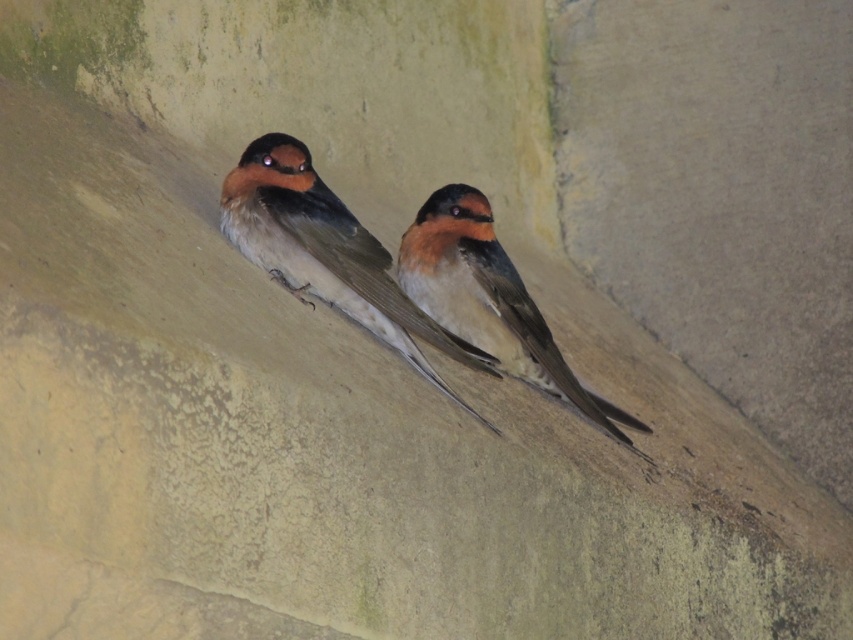
You are a birdwatcher observing two swallows perched on a wall. You notice the brown feathered swallow at center and the brown matte swallow at center. Which swallow is positioned higher on the wall?

The brown feathered swallow at center is positioned higher on the wall than the brown matte swallow at center.

From the picture: You are a birdwatcher trying to photograph two swallows perched on a wall. You notice the brown feathered swallow at center and the brown matte swallow at center. Which swallow is positioned closer to you?

The brown feathered swallow at center is closer to the viewer than the brown matte swallow at center.